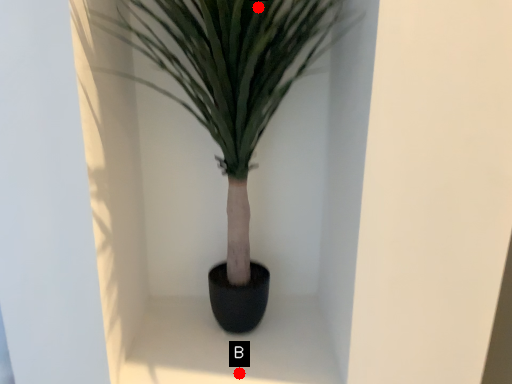
Question: Two points are circled on the image, labeled by A and B beside each circle. Which point is closer to the camera?

Choices:
 (A) A is closer
 (B) B is closer

Answer: (A)